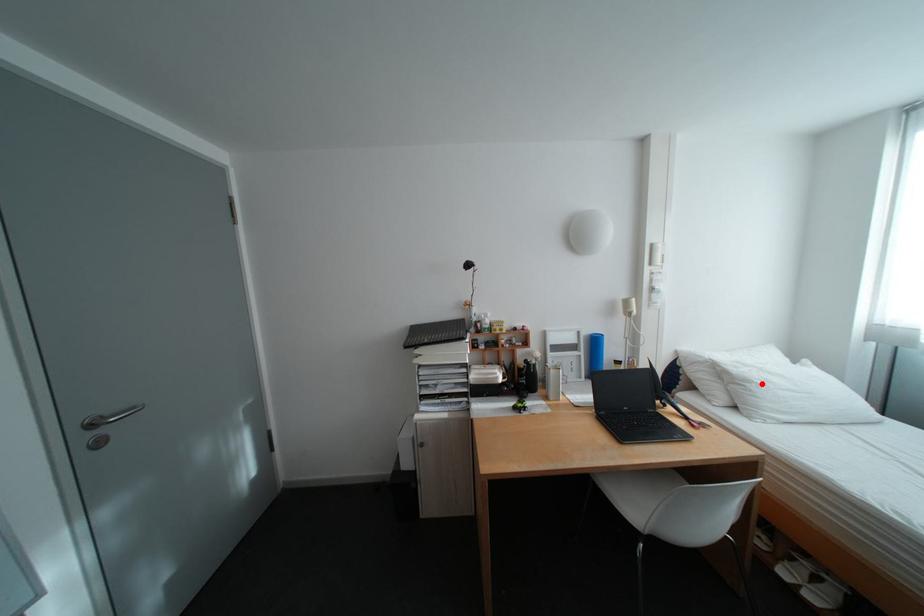
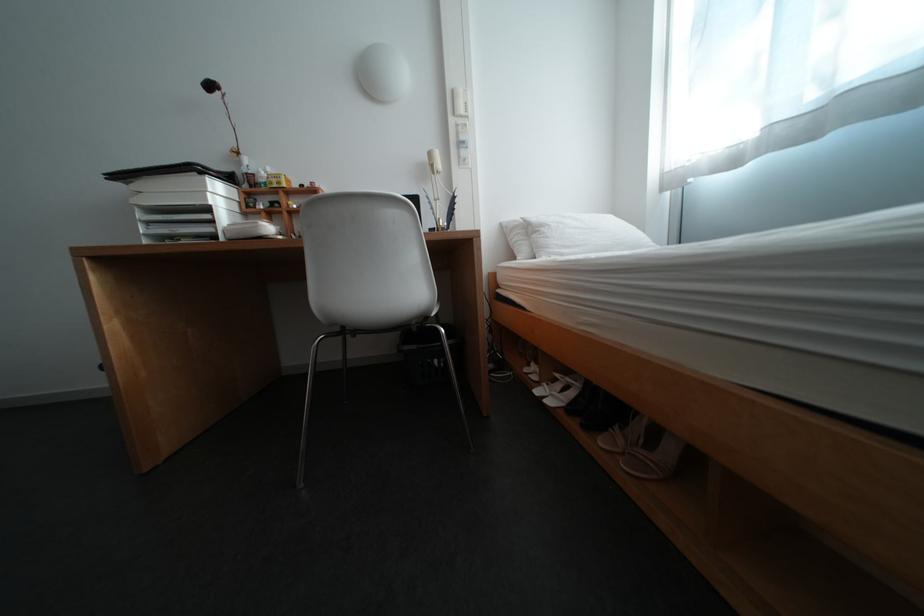
Question: I am providing you with two images of the same scene from different viewpoints. In image1, a red point is highlighted. Considering the same 3D point in image2, which of the following is correct?

Choices:
 (A) It is closer
 (B) It is farther

Answer: (A)